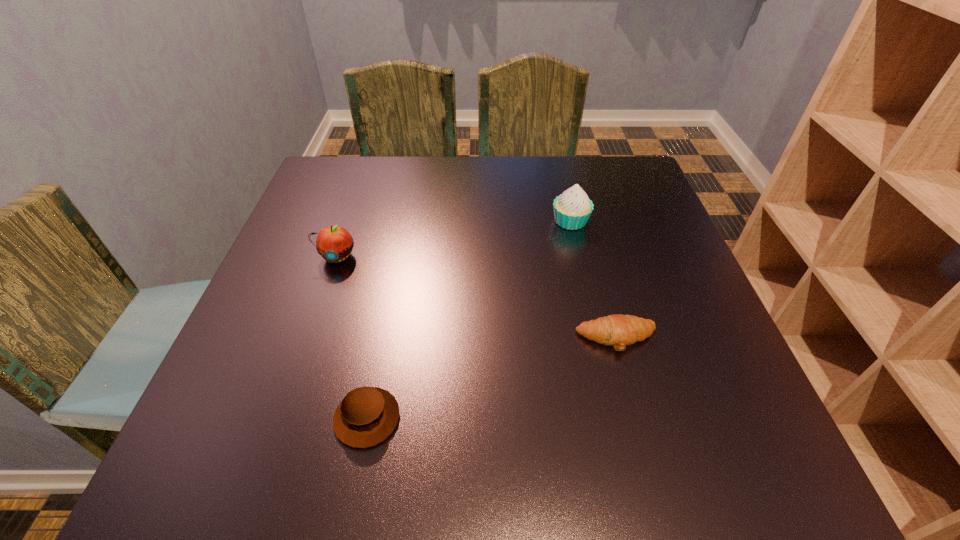
At what (x,y) coordinates should I click in order to perform the action: click on vacant space that is in between the third shortest object and the farthest object. Please return your answer as a coordinate pair (x, y). The image size is (960, 540). Looking at the image, I should click on (454, 239).

This screenshot has width=960, height=540. In order to click on free space between the shortest object and the cupcake in this screenshot , I will do `click(593, 280)`.

The height and width of the screenshot is (540, 960). I want to click on free space between the farthest object and the shortest object, so click(x=593, y=280).

The image size is (960, 540). In order to click on free space between the nearest object and the farthest object in this screenshot , I will do `click(468, 320)`.

At what (x,y) coordinates should I click in order to perform the action: click on free space between the tallest object and the third tallest object. Please return your answer as a coordinate pair (x, y). Looking at the image, I should click on (468, 320).

Find the location of a particular element. This screenshot has height=540, width=960. free space between the crescent roll and the nearest object is located at coordinates (492, 379).

The height and width of the screenshot is (540, 960). I want to click on free space between the crescent roll and the third shortest object, so click(x=477, y=298).

Locate an element on the screen. vacant space that's between the muffin and the second tallest object is located at coordinates (352, 337).

The height and width of the screenshot is (540, 960). Identify the location of vacant area that lies between the crescent roll and the second tallest object. (477, 298).

The height and width of the screenshot is (540, 960). I want to click on free spot between the farthest object and the second farthest object, so click(454, 239).